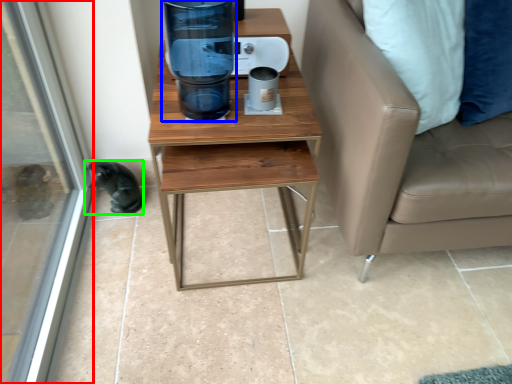
Question: Which is nearer to the screen door (highlighted by a red box)? water cooler (highlighted by a blue box) or animal (highlighted by a green box).

Choices:
 (A) water cooler
 (B) animal

Answer: (B)